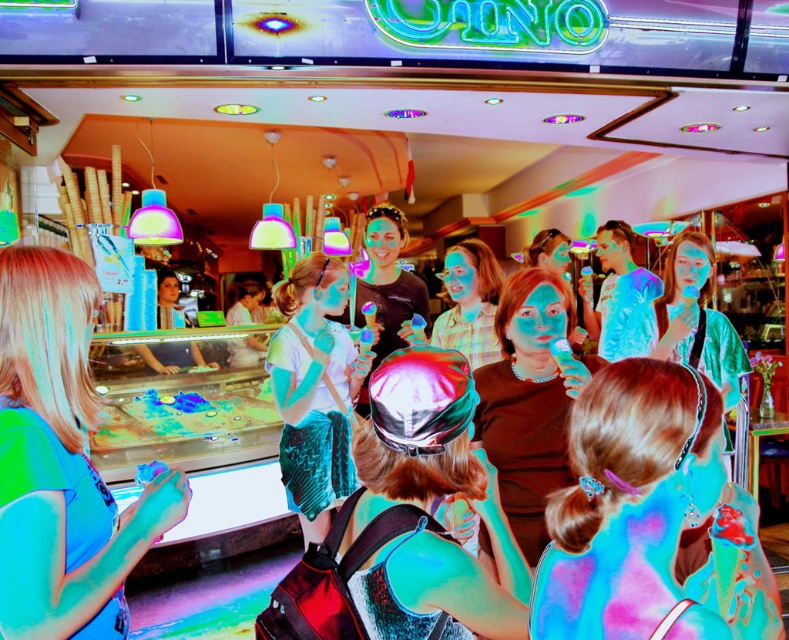
Is green matte shirt at left in front of velvet teal skirt at center?

Yes, it is in front of velvet teal skirt at center.

Measure the distance between point (51, 433) and camera.

Point (51, 433) and camera are 3.91 feet apart.

Does point (77, 454) come in front of point (313, 305)?

Yes.

You are a GUI agent. You are given a task and a screenshot of the screen. Output one action in this format:
    pyautogui.click(x=<x>, y=<y>)
    Task: Click on the green matte shirt at left
    The width and height of the screenshot is (789, 640).
    Given the screenshot: What is the action you would take?
    pyautogui.click(x=60, y=461)

Does shiny blue hair at center appear on the left side of green matte shirt at left?

In fact, shiny blue hair at center is to the right of green matte shirt at left.

Between shiny blue hair at center and green matte shirt at left, which one appears on the left side from the viewer's perspective?

Positioned to the left is green matte shirt at left.

Describe the element at coordinates (642, 516) in the screenshot. This screenshot has width=789, height=640. I see `shiny blue hair at center` at that location.

Identify the location of shiny blue hair at center. This screenshot has height=640, width=789. (642, 516).

Between shiny blue hair at center and velvet teal skirt at center, which one has less height?

With less height is shiny blue hair at center.

Is shiny blue hair at center smaller than velvet teal skirt at center?

Indeed, shiny blue hair at center has a smaller size compared to velvet teal skirt at center.

Which is in front, point (683, 444) or point (326, 300)?

Point (683, 444)

The width and height of the screenshot is (789, 640). In order to click on shiny blue hair at center in this screenshot , I will do `click(642, 516)`.